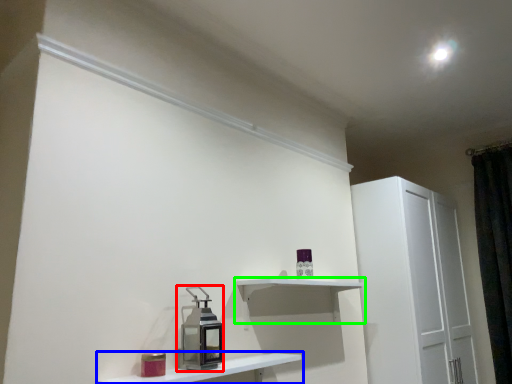
Question: Considering the real-world distances, which object is farthest from appliance (highlighted by a red box)? shelf (highlighted by a blue box) or shelf (highlighted by a green box)?

Choices:
 (A) shelf
 (B) shelf

Answer: (B)